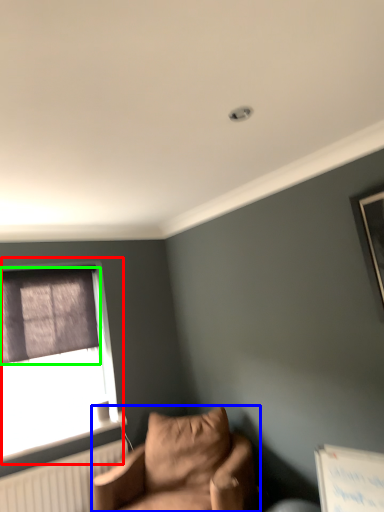
Question: Estimate the real-world distances between objects in this image. Which object is closer to window (highlighted by a red box), studio couch (highlighted by a blue box) or curtain (highlighted by a green box)?

Choices:
 (A) studio couch
 (B) curtain

Answer: (B)